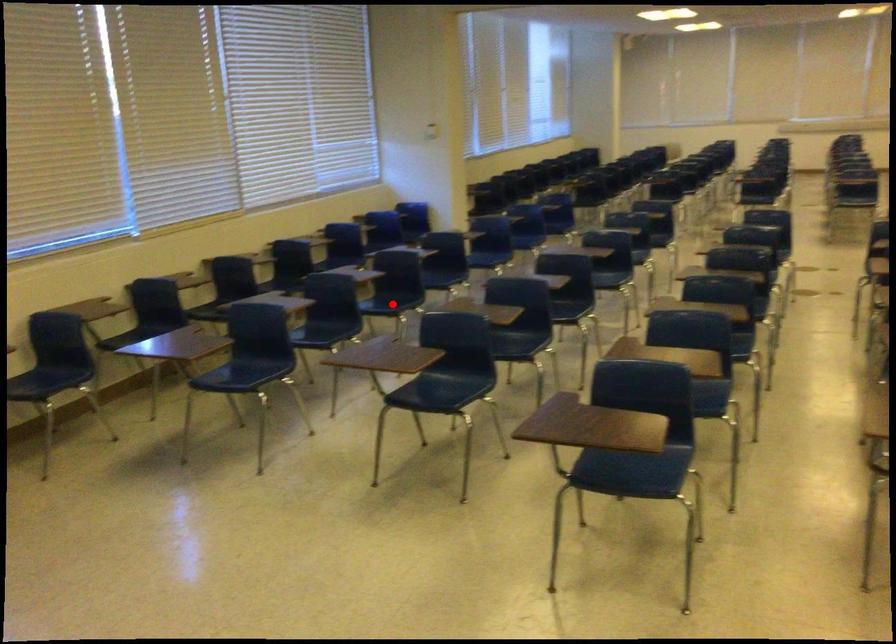
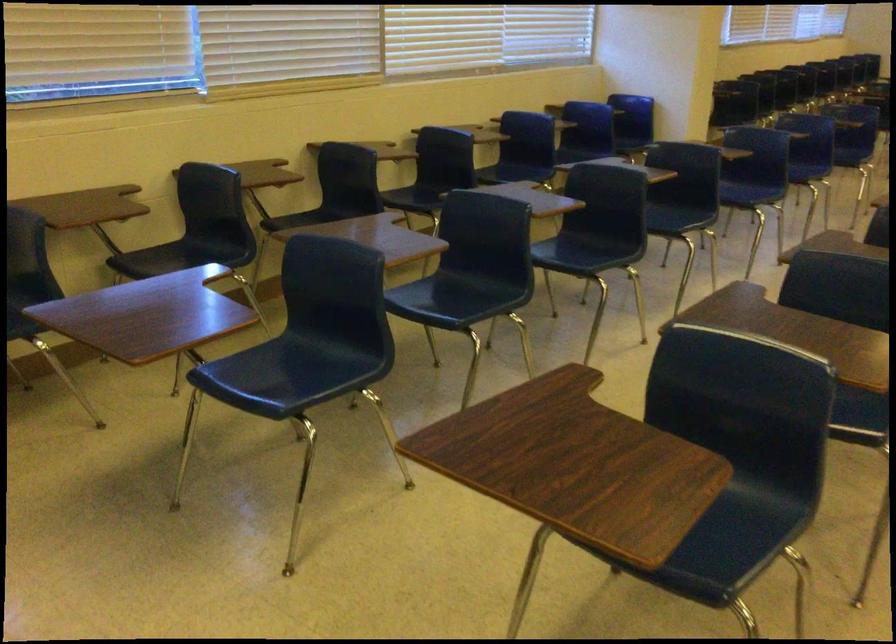
Question: I am providing you with two images of the same scene from different viewpoints. Image1 has a red point marked. In image2, the corresponding 3D location appears at what relative position? Reply with the corresponding letter.

Choices:
 (A) Closer
 (B) Farther

Answer: (A)